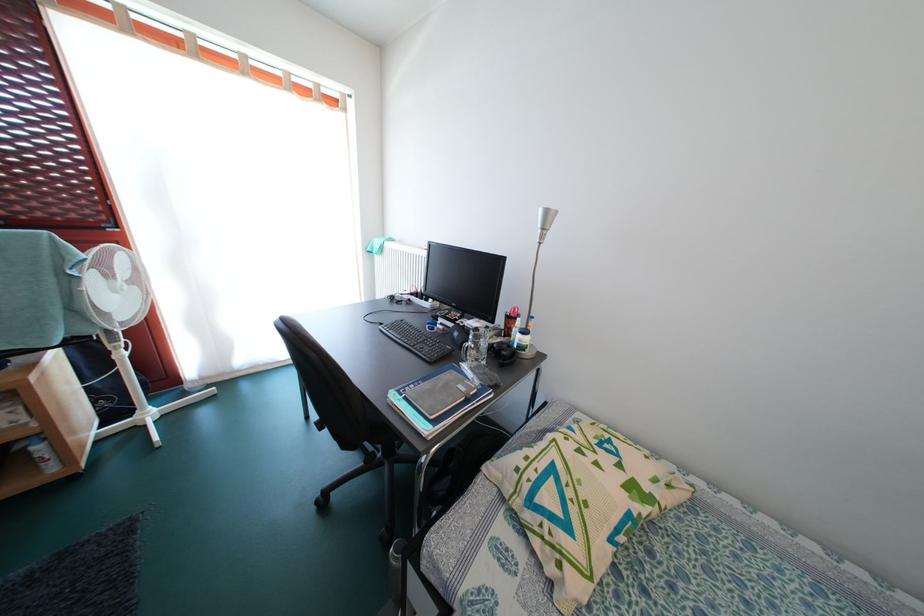
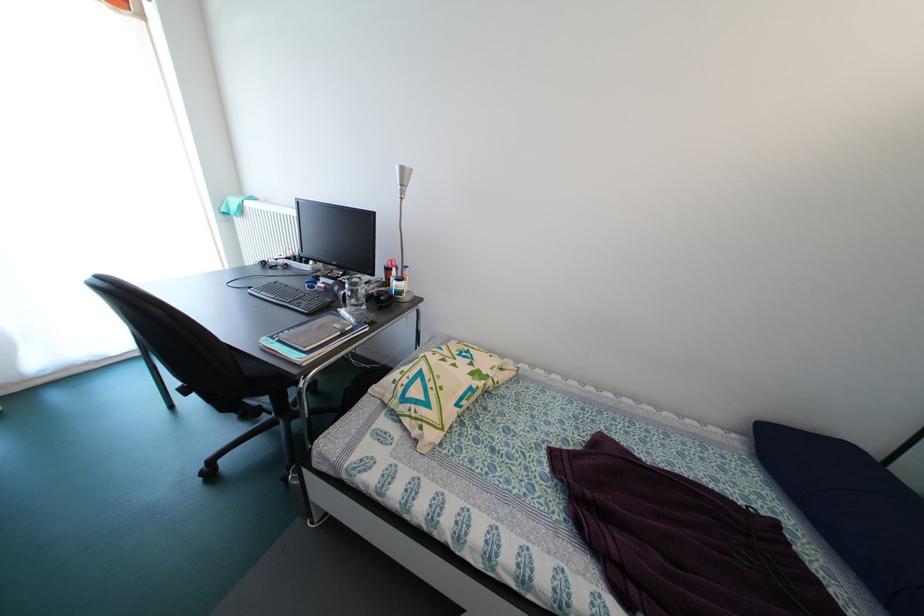
Find the pixel in the second image that matches point (323, 508) in the first image.

(209, 479)